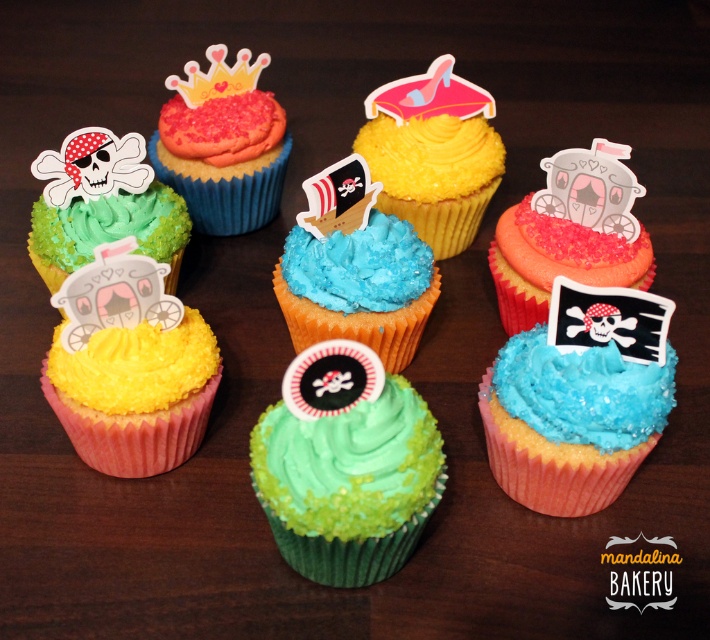
Question: Where is green matte cupcake at center located in relation to yellow matte cupcake at center in the image?

Choices:
 (A) below
 (B) above

Answer: (A)

Question: Which point is farther to the camera?

Choices:
 (A) gold metallic crown at upper center
 (B) blue glittery pirate flag at center
 (C) green matte cupcake at center

Answer: (A)

Question: Is blue sugar-coated cupcake at center to the left of yellow matte cupcake at center from the viewer's perspective?

Choices:
 (A) no
 (B) yes

Answer: (B)

Question: Does blue glittery pirate flag at center have a smaller size compared to blue sugar-coated cupcake at center?

Choices:
 (A) yes
 (B) no

Answer: (B)

Question: Which object is farther from the camera taking this photo?

Choices:
 (A) blue glittery pirate flag at center
 (B) gold metallic crown at upper center
 (C) blue sugar-coated cupcake at center
 (D) yellow paper crown at upper center

Answer: (B)

Question: Which point appears closest to the camera in this image?

Choices:
 (A) [584, 376]
 (B) [356, 257]

Answer: (A)